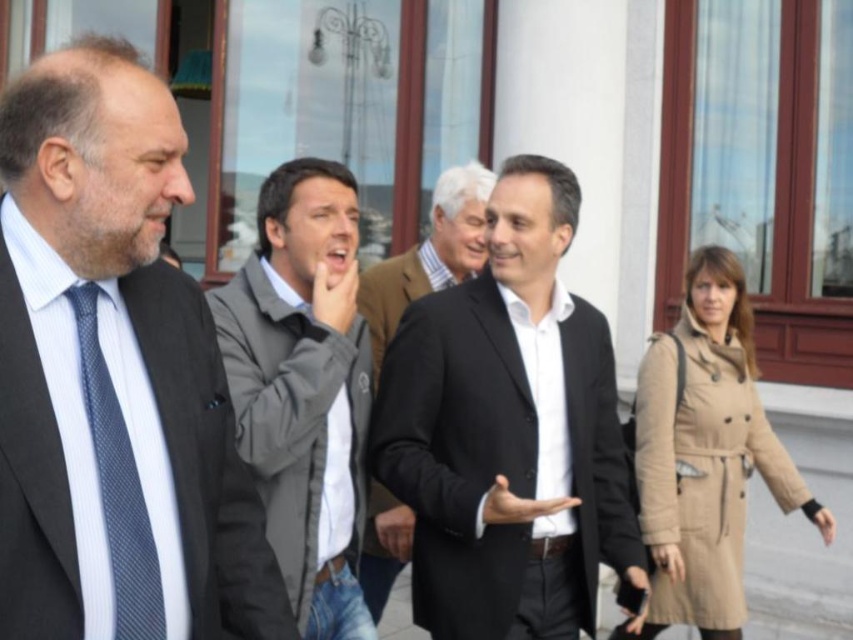
Does point (96, 209) come in front of point (434, 264)?

Yes, it is in front of point (434, 264).

Can you confirm if matte black suit at left is bigger than black wool suit at center?

Yes.

This screenshot has height=640, width=853. What are the coordinates of `matte black suit at left` in the screenshot? It's located at (115, 353).

At what (x,y) coordinates should I click in order to perform the action: click on matte black suit at left. Please return your answer as a coordinate pair (x, y). Looking at the image, I should click on (115, 353).

Who is taller, black wool coat at center or black wool suit at center?

black wool coat at center

Is point (529, 172) positioned behind point (372, 333)?

No, it is in front of (372, 333).

Does point (529, 557) come farther from viewer compared to point (416, 260)?

No, it is not.

Locate an element on the screen. black wool coat at center is located at coordinates (508, 433).

Does matte black suit at left have a greater height compared to black wool coat at center?

In fact, matte black suit at left may be shorter than black wool coat at center.

Describe the element at coordinates (115, 353) in the screenshot. I see `matte black suit at left` at that location.

Describe the element at coordinates (115, 353) in the screenshot. I see `matte black suit at left` at that location.

The width and height of the screenshot is (853, 640). I want to click on matte black suit at left, so click(x=115, y=353).